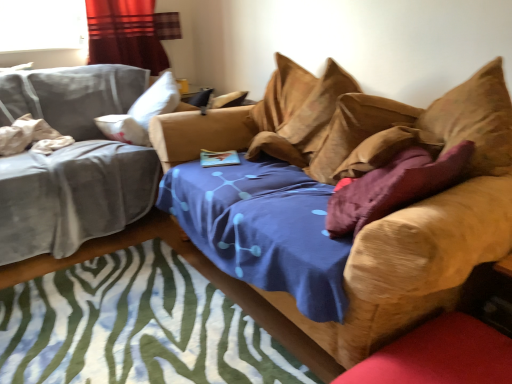
Question: Looking at their shapes, would you say velvet curtain at upper left is wider or thinner than velvet purple pillow at center, marked as the third pillow in a left-to-right arrangement?

Choices:
 (A) wide
 (B) thin

Answer: (B)

Question: Considering the relative positions of velvet curtain at upper left and velvet purple pillow at center, marked as the third pillow in a left-to-right arrangement, in the image provided, is velvet curtain at upper left to the left or to the right of velvet purple pillow at center, marked as the third pillow in a left-to-right arrangement,?

Choices:
 (A) left
 (B) right

Answer: (A)

Question: Estimate the real-world distances between objects in this image. Which object is farther from the zebra-patterned rug at center?

Choices:
 (A) white cotton pillow at left, which is the 1th pillow from left to right
 (B) velvet purple pillow at center, which is the second pillow in right-to-left order
 (C) suede-like brown pillow at upper right, acting as the 1th pillow starting from the right
 (D) velvet brown couch at center, the 1th studio couch viewed from the right
 (E) velvet curtain at upper left

Answer: (E)

Question: Considering the real-world distances, which object is farthest from the suede-like brown pillow at upper right, arranged as the 4th pillow when viewed from the left?

Choices:
 (A) velvet brown couch at center, the 1th studio couch viewed from the right
 (B) zebra-patterned rug at center
 (C) white cotton pillow at left, which is the 1th pillow from left to right
 (D) velvet purple pillow at center, marked as the third pillow in a left-to-right arrangement
 (E) velvet gray studio couch at left, the 1th studio couch viewed from the left

Answer: (C)